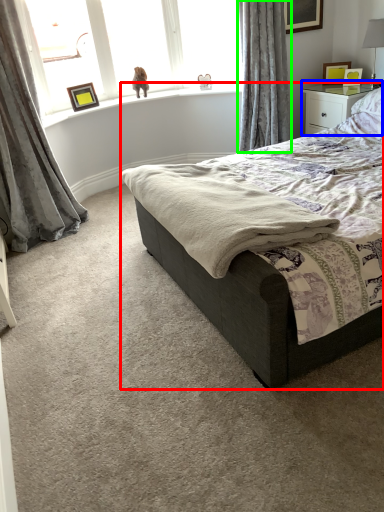
Question: Which is nearer to the bed (highlighted by a red box)? nightstand (highlighted by a blue box) or curtain (highlighted by a green box).

Choices:
 (A) nightstand
 (B) curtain

Answer: (A)